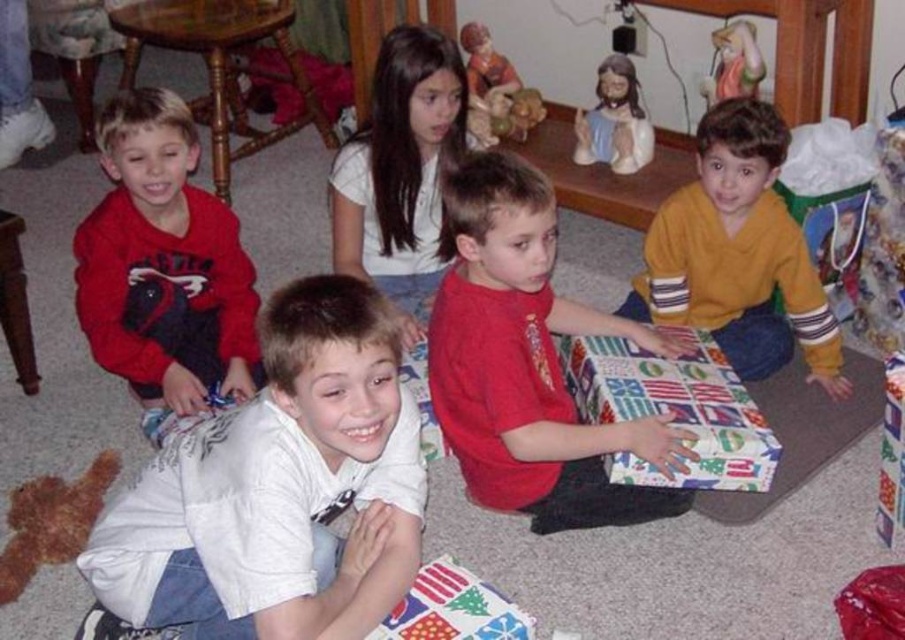
Does matte ceramic figurine at upper center appear over porcelain figurine at upper right?

Actually, matte ceramic figurine at upper center is below porcelain figurine at upper right.

Does matte ceramic figurine at upper center appear on the right side of porcelain figurine at upper right?

No, matte ceramic figurine at upper center is not to the right of porcelain figurine at upper right.

Locate an element on the screen. The height and width of the screenshot is (640, 905). matte ceramic figurine at upper center is located at coordinates (614, 120).

Identify the location of matte ceramic figurine at upper center. The width and height of the screenshot is (905, 640). (614, 120).

Between yellow fleece sweater at right and matte brown teddy bear at center, which one is positioned lower?

yellow fleece sweater at right is below.

You are a GUI agent. You are given a task and a screenshot of the screen. Output one action in this format:
    pyautogui.click(x=<x>, y=<y>)
    Task: Click on the yellow fleece sweater at right
    
    Given the screenshot: What is the action you would take?
    pyautogui.click(x=738, y=253)

Measure the distance from matte red sweatshirt at left to matte ceramic figurine at upper center.

They are 1.35 meters apart.

Between point (182, 371) and point (586, 138), which one is positioned behind?

Positioned behind is point (586, 138).

This screenshot has width=905, height=640. Identify the location of matte red sweatshirt at left. (163, 264).